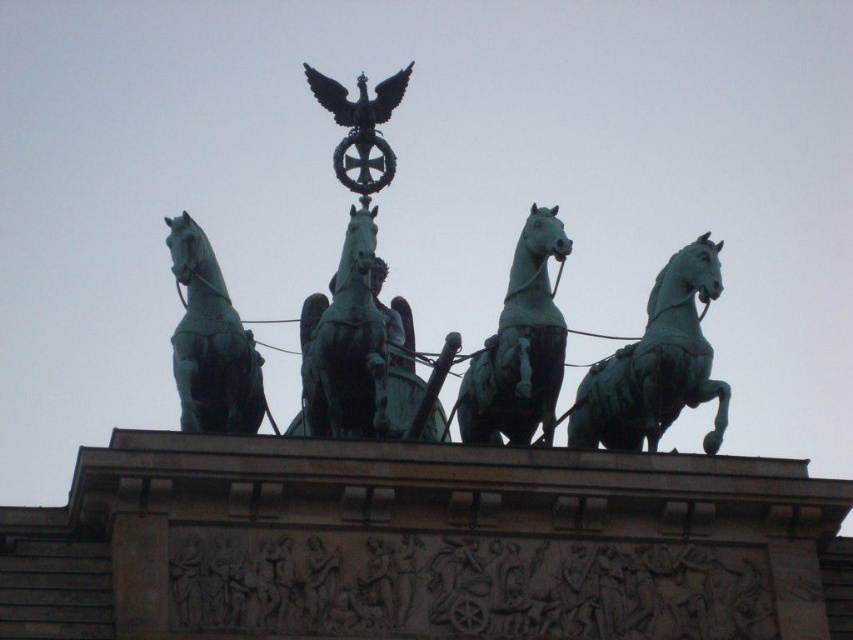
You are a maintenance worker needing to inspect the green polished metal horse at right and the green polished metal horse at center. Given that you can only move along the stone base they are mounted on, which is 25 feet long, will you be able to reach both horses without exceeding the base length?

The distance between the green polished metal horse at right and the green polished metal horse at center is 20.72 feet. Since the stone base is 25 feet long, you can reach both horses without exceeding the base length as 20.72 feet is less than 25 feet.

You are standing in front of the monument and want to take a photo of the green polished bronze chariot at center and the green polished metal horse at right. Which object will appear larger in your photo?

The green polished bronze chariot at center will appear larger in the photo because it is closer to the viewer than the green polished metal horse at right.

You are standing at the base of the monument and want to take a photo of the green polished bronze chariot at center with your camera. Given that the camera can focus on objects up to 300 feet away, will you be able to capture a clear image?

The green polished bronze chariot at center and camera are 341.99 feet apart, which is beyond the camera maximum focus range of 300 feet. Therefore, you won not be able to capture a clear image.